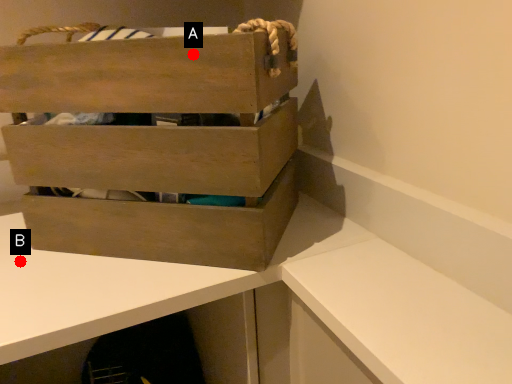
Question: Two points are circled on the image, labeled by A and B beside each circle. Which point is closer to the camera?

Choices:
 (A) A is closer
 (B) B is closer

Answer: (A)